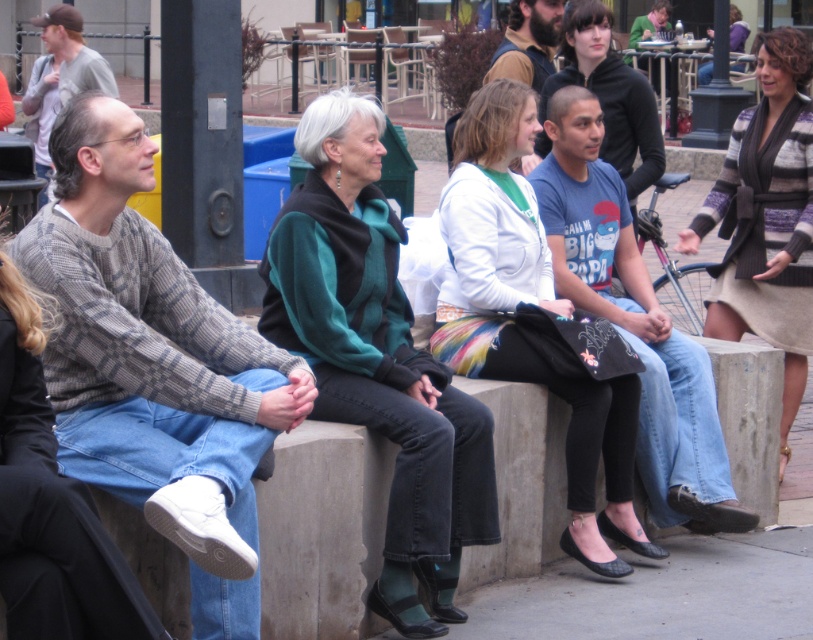
You are standing in the city plaza and notice the knit sweater at left on the concrete bench. Can you determine its exact location based on the coordinates provided?

The knit sweater at left is located at point (154, 365).

You are a photographer standing at the center of the plaza. You want to take a photo of the white textured sweater at center. Where should you aim your camera?

You should aim your camera at point [533,307] to capture the white textured sweater at center.

You are a fashion designer observing the crowd and want to create a new collection inspired by the sweaters seen on the bench. Which sweater, the white textured sweater at center or the striped knit sweater at center, should you choose if you want to emphasize a bold, voluminous style?

The white textured sweater at center is larger in size than the striped knit sweater at center, so you should choose the white textured sweater at center to emphasize a bold, voluminous style.